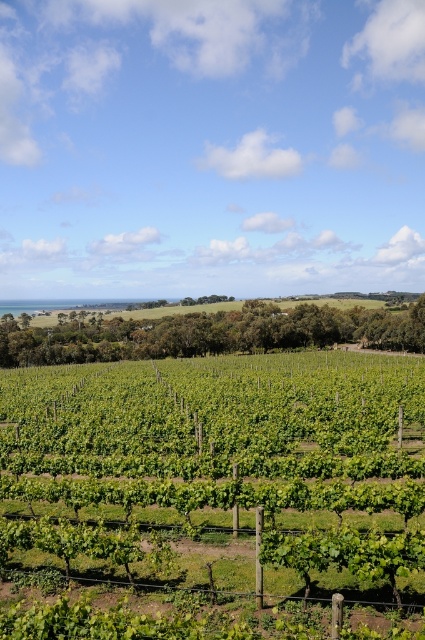
Question: Which object appears closest to the camera in this image?

Choices:
 (A) green leafy vines at center
 (B) green grassy hillside at center

Answer: (A)

Question: Is green leafy vines at center to the left of green grassy hillside at center from the viewer's perspective?

Choices:
 (A) yes
 (B) no

Answer: (B)

Question: Can you confirm if green leafy vines at center is bigger than green grassy hillside at center?

Choices:
 (A) no
 (B) yes

Answer: (A)

Question: Which of the following is the farthest from the observer?

Choices:
 (A) green leafy vines at center
 (B) green grassy hillside at center

Answer: (B)

Question: Does green leafy vines at center have a larger size compared to green grassy hillside at center?

Choices:
 (A) yes
 (B) no

Answer: (B)